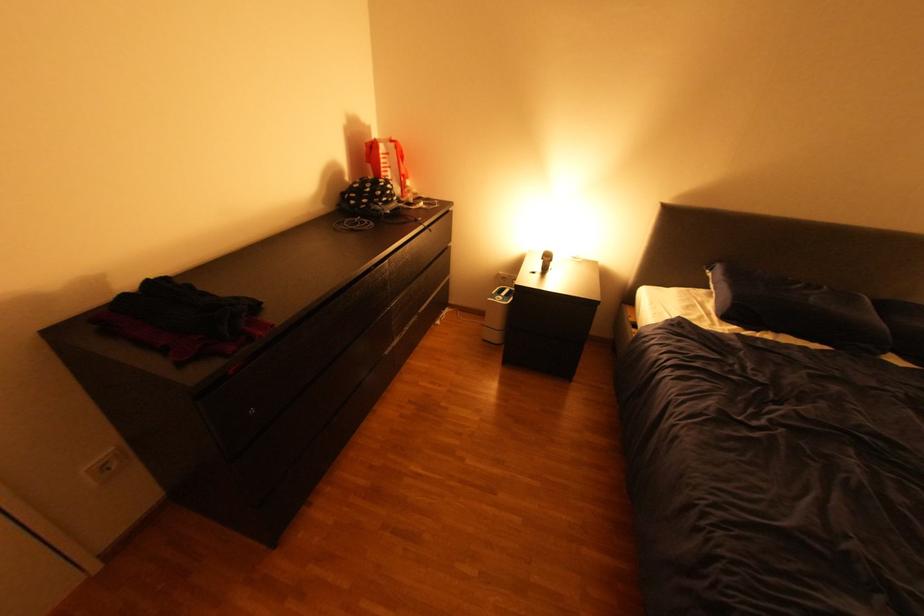
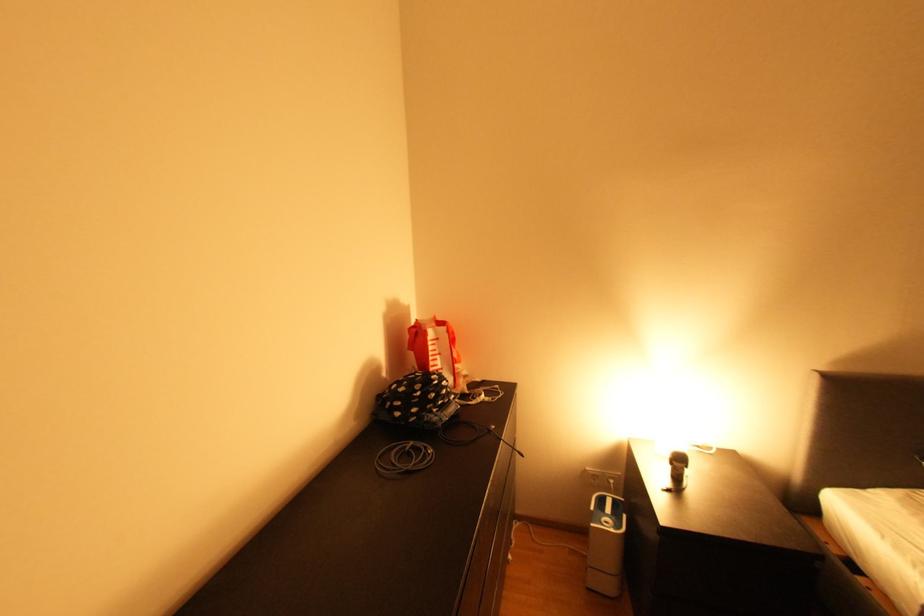
The point at [402,192] is marked in the first image. Where is the corresponding point in the second image?

(457, 389)